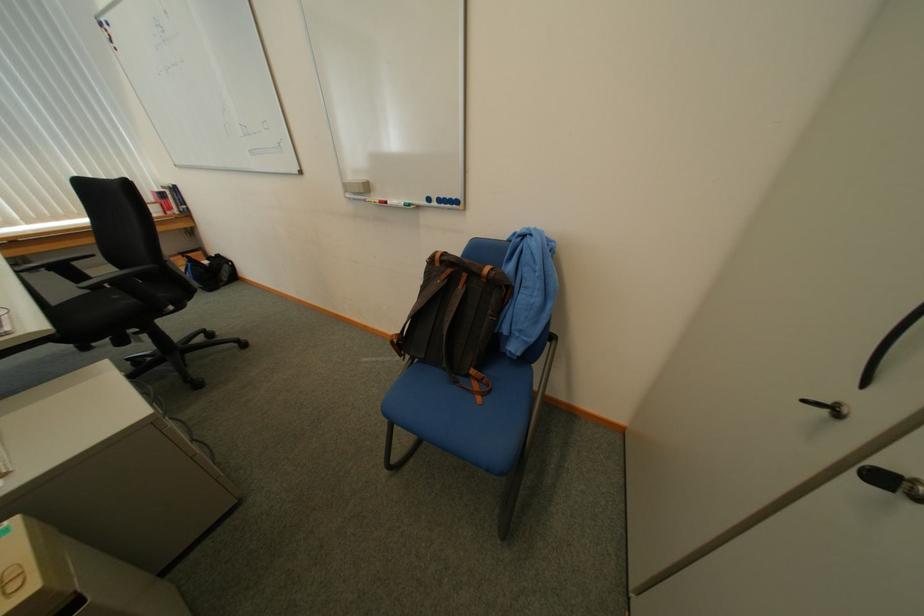
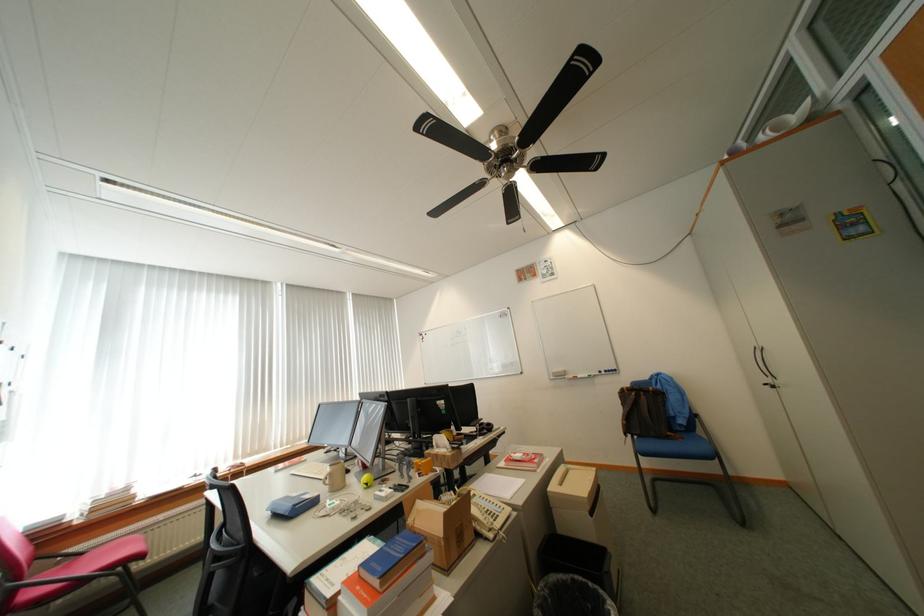
Locate, in the second image, the point that corresponds to point 421,359 in the first image.

(641, 438)